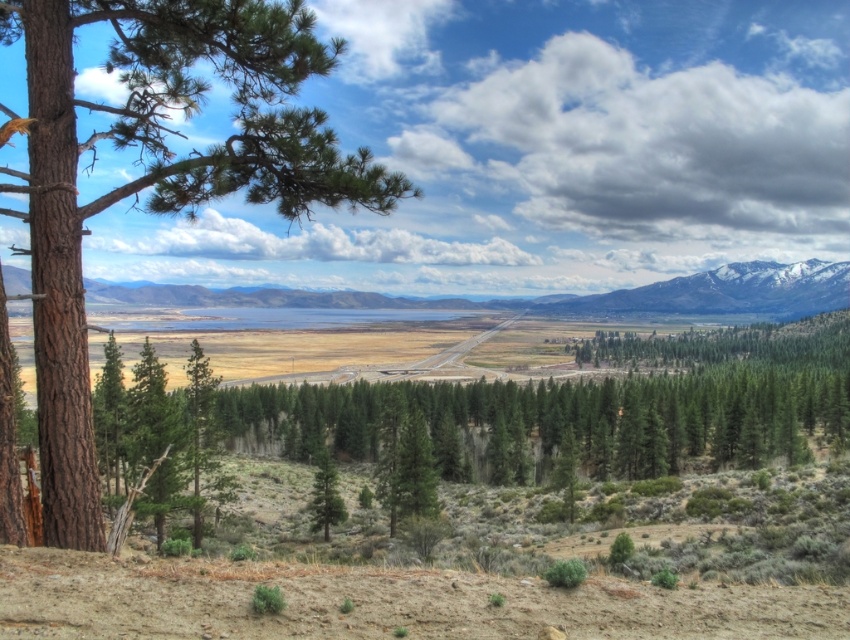
You are standing in the landscape scene described. There is a point labeled as point (726,291). What does this point represent in the scene?

The point (726,291) represents the snowy granite mountain at upper right.

From the picture: You are a hiker standing at the base of the brown rough bark tree at left. You want to take a photo of the snowy granite mountain at upper right. Is the tree trunk blocking your view of the mountain?

The brown rough bark tree at left is much taller than the snowy granite mountain at upper right, so the tree trunk would block your view of the mountain.

You are an artist sketching this landscape. You want to emphasize the scale of the brown rough bark tree at left and the snowy granite mountain at upper right. Which object should you draw larger in your sketch to maintain the scene proportions?

You should draw the brown rough bark tree at left larger than the snowy granite mountain at upper right because it is larger in size according to the description.